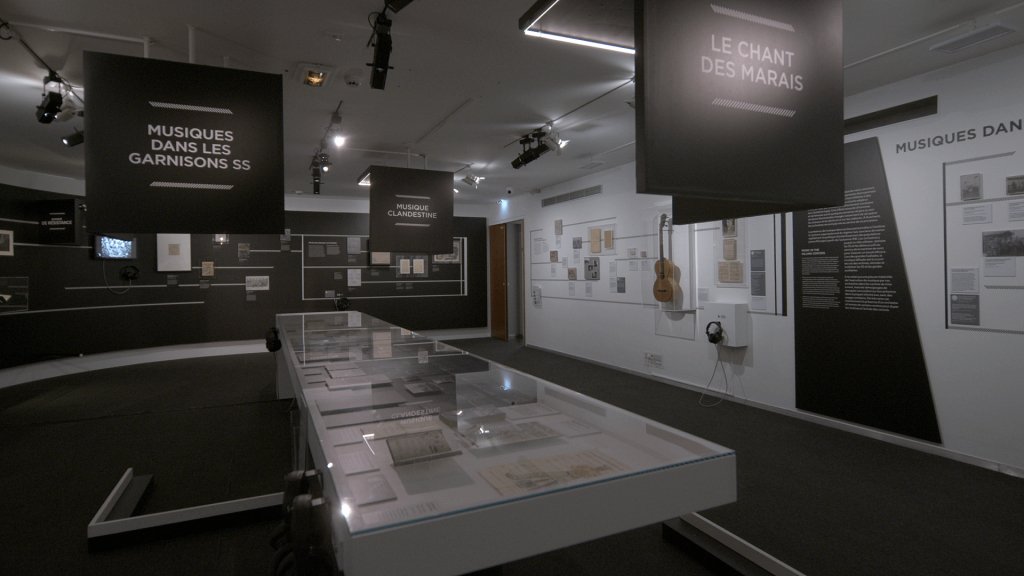
Where is `floor`? Image resolution: width=1024 pixels, height=576 pixels. floor is located at coordinates (604, 372), (161, 433).